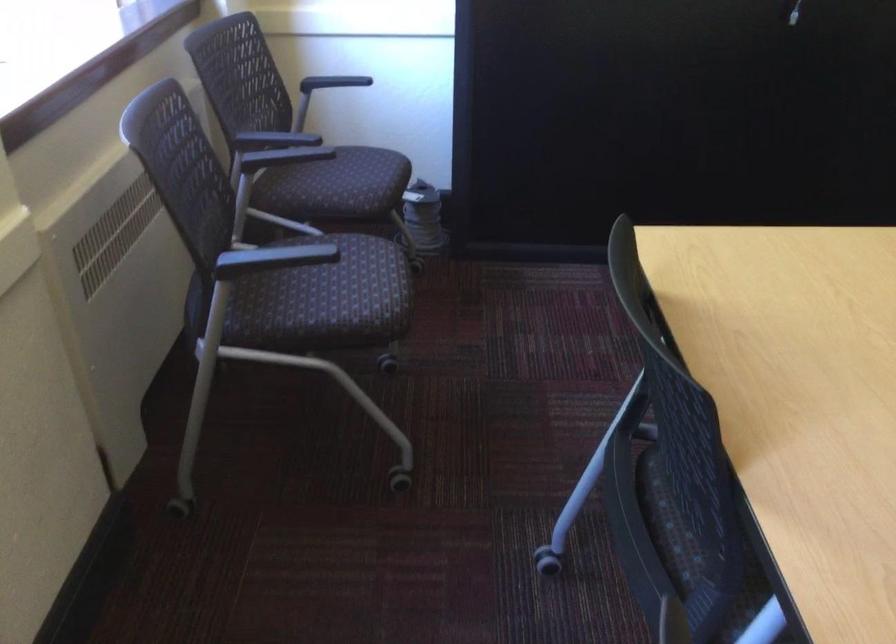
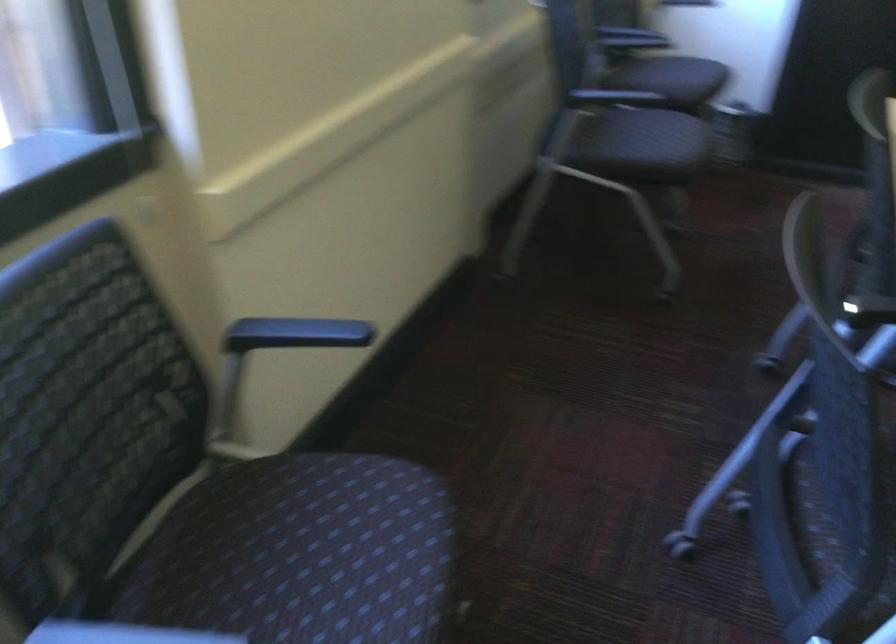
Question: The images are taken continuously from a first-person perspective. In which direction is your viewpoint rotating?

Choices:
 (A) Left
 (B) Right
 (C) Up
 (D) Down

Answer: (A)